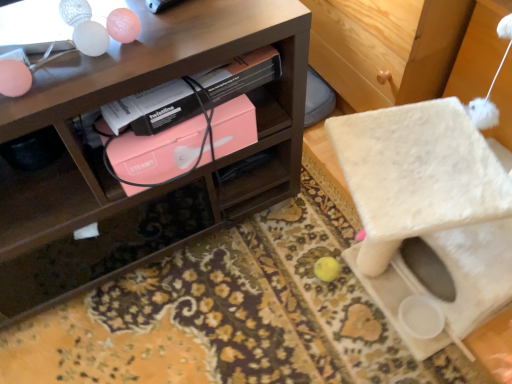
Question: Is wooden shelf at upper left surrounded by pink matte box at center?

Choices:
 (A) yes
 (B) no

Answer: (B)

Question: Does pink matte box at center have a lesser width compared to wooden shelf at upper left?

Choices:
 (A) yes
 (B) no

Answer: (A)

Question: From the image's perspective, would you say pink matte box at center is shown under wooden shelf at upper left?

Choices:
 (A) no
 (B) yes

Answer: (A)

Question: Considering the relative sizes of pink matte box at center and wooden shelf at upper left in the image provided, is pink matte box at center taller than wooden shelf at upper left?

Choices:
 (A) no
 (B) yes

Answer: (A)

Question: From the image's perspective, does pink matte box at center appear higher than wooden shelf at upper left?

Choices:
 (A) no
 (B) yes

Answer: (B)

Question: Considering the relative sizes of pink matte box at center and wooden shelf at upper left in the image provided, is pink matte box at center wider than wooden shelf at upper left?

Choices:
 (A) yes
 (B) no

Answer: (B)

Question: Is the depth of pink matte box at center greater than that of pink matte box at center?

Choices:
 (A) yes
 (B) no

Answer: (B)

Question: Considering the relative positions of pink matte box at center and pink matte box at center in the image provided, is pink matte box at center to the left of pink matte box at center from the viewer's perspective?

Choices:
 (A) no
 (B) yes

Answer: (A)

Question: From a real-world perspective, does pink matte box at center stand above pink matte box at center?

Choices:
 (A) yes
 (B) no

Answer: (A)

Question: Is pink matte box at center oriented away from pink matte box at center?

Choices:
 (A) no
 (B) yes

Answer: (A)

Question: Can you confirm if pink matte box at center is taller than pink matte box at center?

Choices:
 (A) no
 (B) yes

Answer: (A)

Question: Does pink matte box at center turn towards pink matte box at center?

Choices:
 (A) yes
 (B) no

Answer: (B)

Question: Is pink matte box at center positioned far away from pink matte box at center?

Choices:
 (A) no
 (B) yes

Answer: (A)